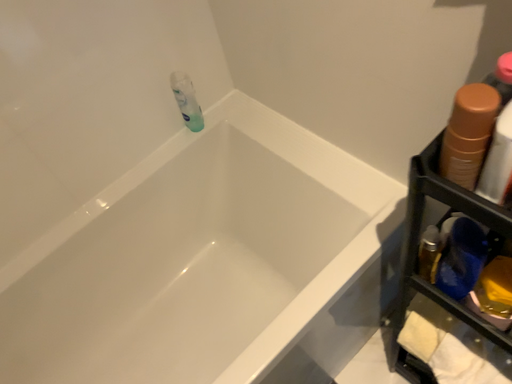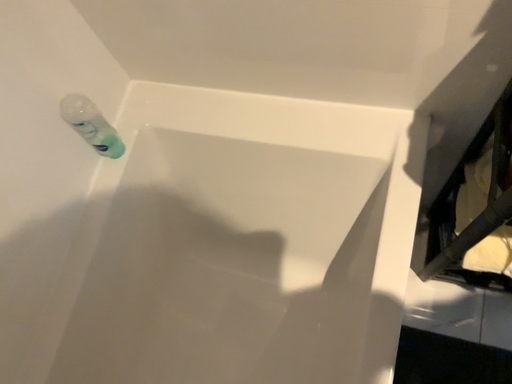
Question: Which way did the camera rotate in the video?

Choices:
 (A) rotated right
 (B) rotated left

Answer: (A)